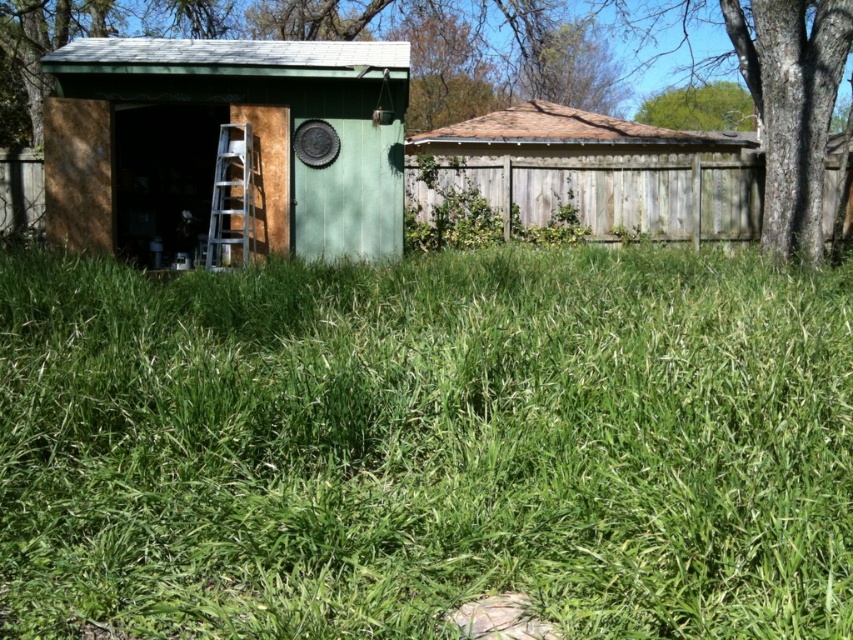
Between point (300, 573) and point (355, 92), which one is positioned in front?

Point (300, 573) is in front.

Between green grassy at center and green painted wood shed at center, which one is positioned higher?

green painted wood shed at center is higher up.

At what (x,y) coordinates should I click in order to perform the action: click on green grassy at center. Please return your answer as a coordinate pair (x, y). Looking at the image, I should click on (426, 445).

Can you confirm if green painted wood shed at center is positioned below weathered wood fence at upper center?

Correct, green painted wood shed at center is located below weathered wood fence at upper center.

Is point (360, 97) in front of point (596, 198)?

Yes, point (360, 97) is closer to viewer.

This screenshot has width=853, height=640. In order to click on green painted wood shed at center in this screenshot , I will do `click(222, 141)`.

Is the position of green grassy at center more distant than that of silver metallic ladder at center?

No, green grassy at center is closer to the viewer.

Can you confirm if green grassy at center is positioned to the left of silver metallic ladder at center?

Incorrect, green grassy at center is not on the left side of silver metallic ladder at center.

Which is in front, point (416, 472) or point (242, 134)?

Point (416, 472)

Identify the location of green grassy at center. (426, 445).